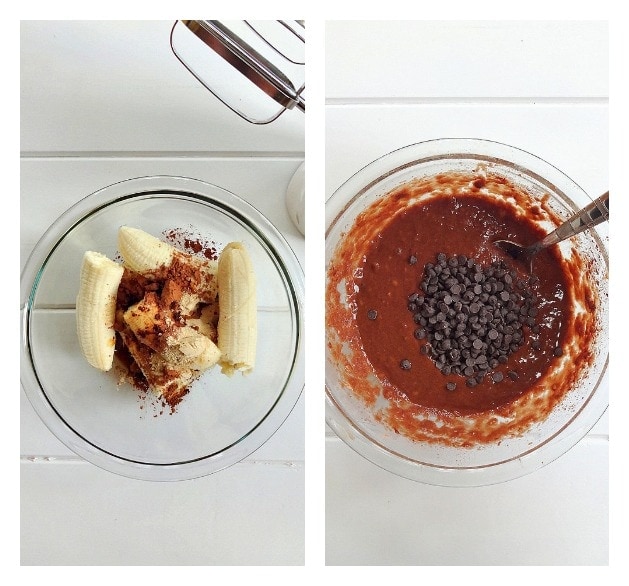
This screenshot has width=629, height=586. I want to click on spoon handle, so click(x=580, y=227).